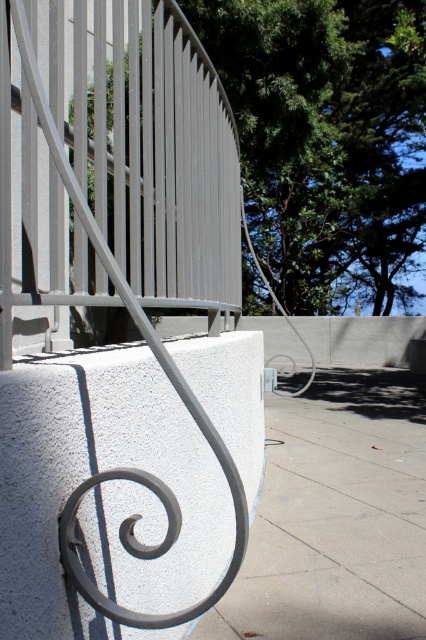
Question: Does white textured concrete at center come in front of gray concrete sidewalk at center?

Choices:
 (A) yes
 (B) no

Answer: (A)

Question: Does white textured concrete at center have a greater width compared to gray concrete sidewalk at center?

Choices:
 (A) yes
 (B) no

Answer: (B)

Question: Does white textured concrete at center appear under gray concrete sidewalk at center?

Choices:
 (A) no
 (B) yes

Answer: (A)

Question: Which of the following is the farthest from the observer?

Choices:
 (A) (77, 618)
 (B) (414, 600)

Answer: (B)